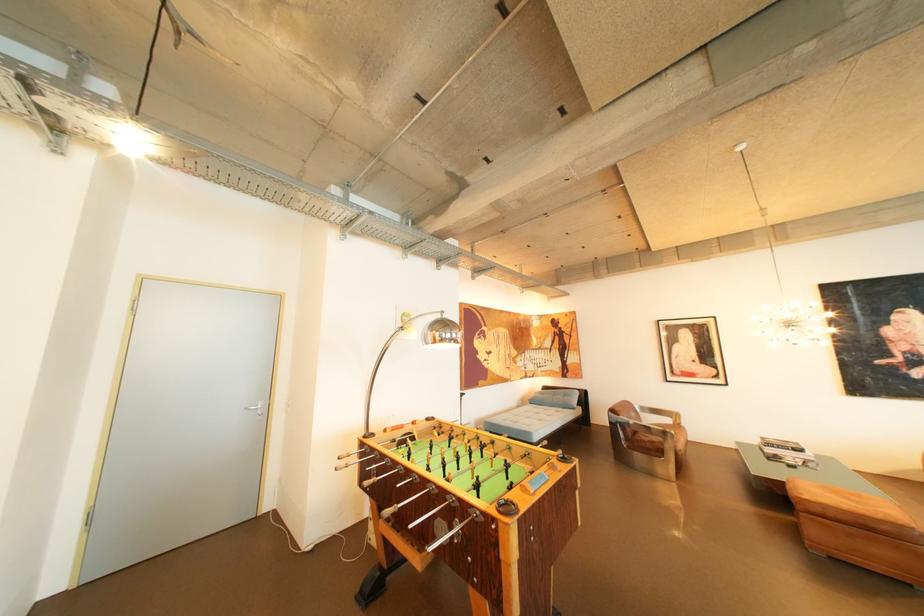
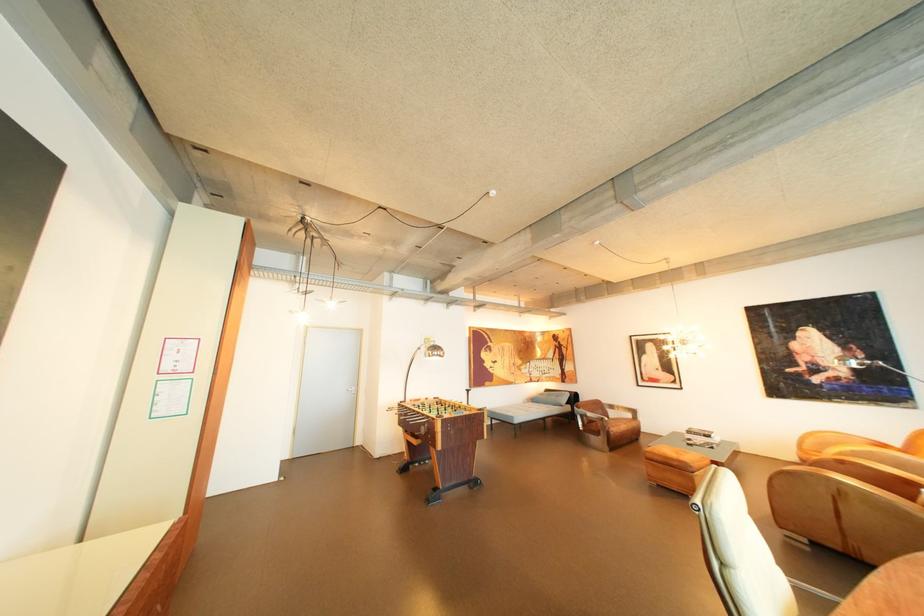
In a continuous first-person perspective shot, in which direction is the camera moving?

The cameraman walked toward right, backward.